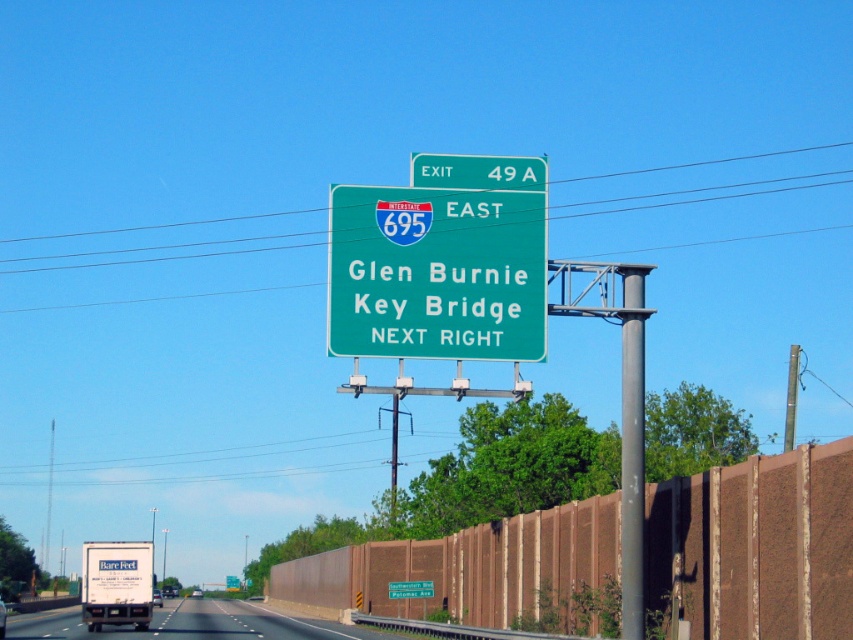
Question: Which point appears closest to the camera in this image?

Choices:
 (A) (253, 627)
 (B) (503, 296)
 (C) (624, 497)

Answer: (B)

Question: Can you confirm if green matte highway sign at center is positioned to the left of green matte sign at upper center?

Choices:
 (A) yes
 (B) no

Answer: (A)

Question: From the image, what is the correct spatial relationship of black asphalt highway at center in relation to green matte sign at upper center?

Choices:
 (A) below
 (B) above

Answer: (A)

Question: Can you confirm if green matte highway sign at center is positioned below green matte sign at upper center?

Choices:
 (A) yes
 (B) no

Answer: (A)

Question: Which is nearer to the gray metallic pole at center-right?

Choices:
 (A) green matte sign at upper center
 (B) black asphalt highway at center

Answer: (A)

Question: Which point appears closest to the camera in this image?

Choices:
 (A) (625, 547)
 (B) (468, 176)

Answer: (B)